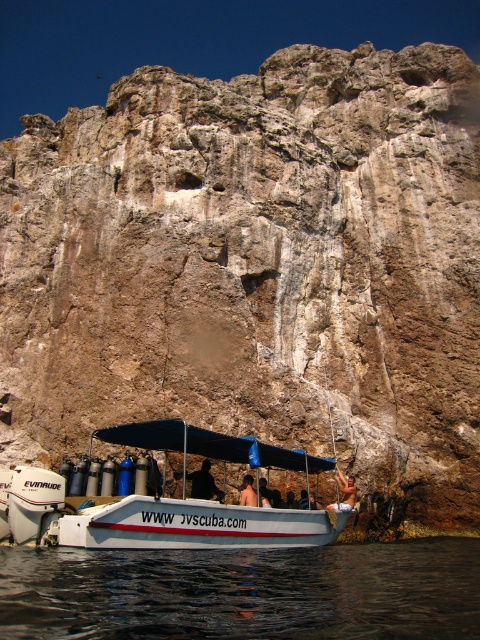
Question: Can you confirm if smooth skin person at center is wider than brown leather jacket at center?

Choices:
 (A) no
 (B) yes

Answer: (B)

Question: Is white matte boat at lower center wider than brown leather jacket at center?

Choices:
 (A) yes
 (B) no

Answer: (A)

Question: Among these objects, which one is farthest from the camera?

Choices:
 (A) white matte boat at lower center
 (B) brown leather jacket at center

Answer: (B)

Question: Which object is positioned farthest from the white matte boat at lower center?

Choices:
 (A) brown leather jacket at center
 (B) black matte person at center
 (C) transparent water at lower center
 (D) smooth skin person at center

Answer: (D)

Question: Does transparent water at lower center come behind smooth skin person at center?

Choices:
 (A) no
 (B) yes

Answer: (A)

Question: Among these points, which one is farthest from the camera?

Choices:
 (A) (242, 496)
 (B) (384, 552)
 (C) (204, 486)

Answer: (B)